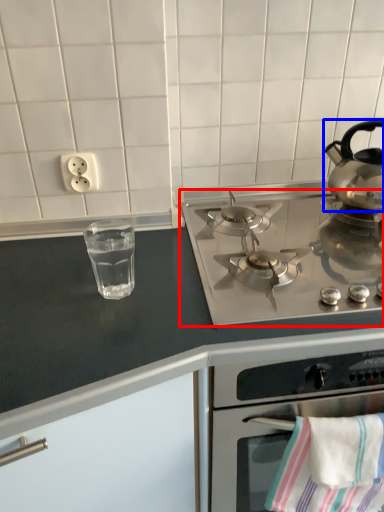
Question: Among these objects, which one is nearest to the camera, gas stove (highlighted by a red box) or kettle (highlighted by a blue box)?

Choices:
 (A) gas stove
 (B) kettle

Answer: (A)